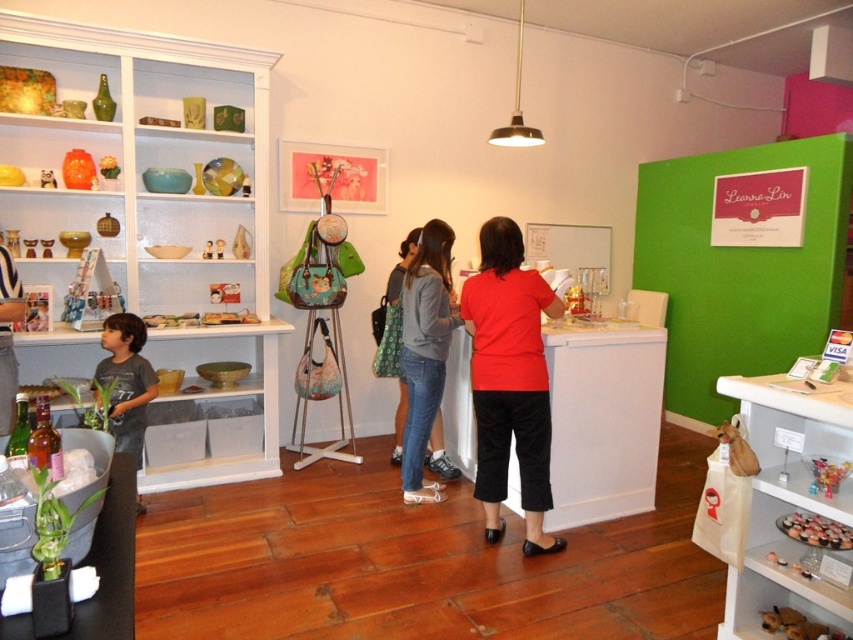
Question: Among these objects, which one is farthest from the camera?

Choices:
 (A) denim jacket at center
 (B) denim jeans at center
 (C) gray cotton shirt at left
 (D) matte black shirt at left

Answer: (A)

Question: Which point appears farthest from the camera in this image?

Choices:
 (A) (1, 388)
 (B) (111, 355)

Answer: (B)

Question: Considering the real-world distances, which object is closest to the matte red blouse at center?

Choices:
 (A) denim jacket at center
 (B) matte black shirt at left

Answer: (A)

Question: Does matte black shirt at left appear on the right side of denim jacket at center?

Choices:
 (A) no
 (B) yes

Answer: (A)

Question: Is matte red blouse at center positioned at the back of gray cotton shirt at left?

Choices:
 (A) no
 (B) yes

Answer: (A)

Question: Does gray cotton shirt at left come behind matte black shirt at left?

Choices:
 (A) no
 (B) yes

Answer: (B)